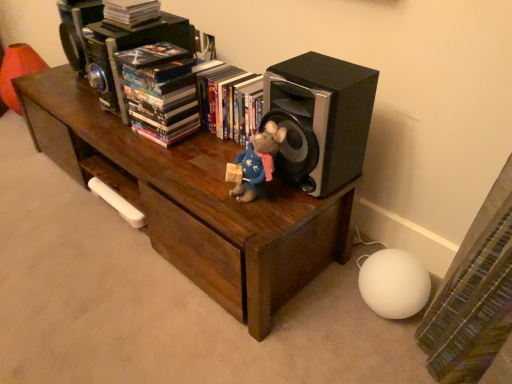
Locate an element on the screen. This screenshot has height=384, width=512. vacant space to the left of hardcover book at center, arranged as the first book when viewed from the right is located at coordinates (184, 149).